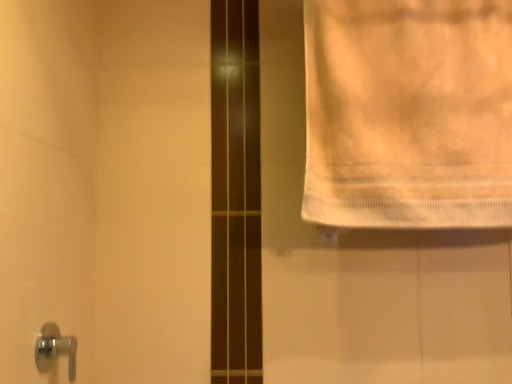
Question: Is white cotton towel at upper right a part of chrome metallic door handle at lower left?

Choices:
 (A) no
 (B) yes

Answer: (A)

Question: Is chrome metallic door handle at lower left not inside white cotton towel at upper right?

Choices:
 (A) yes
 (B) no

Answer: (A)

Question: From a real-world perspective, does chrome metallic door handle at lower left stand above white cotton towel at upper right?

Choices:
 (A) no
 (B) yes

Answer: (A)

Question: Is the position of chrome metallic door handle at lower left less distant than that of white cotton towel at upper right?

Choices:
 (A) yes
 (B) no

Answer: (A)

Question: Is chrome metallic door handle at lower left aimed at white cotton towel at upper right?

Choices:
 (A) yes
 (B) no

Answer: (B)

Question: From the image's perspective, is chrome metallic door handle at lower left over white cotton towel at upper right?

Choices:
 (A) no
 (B) yes

Answer: (A)

Question: Considering the relative sizes of white cotton towel at upper right and chrome metallic door handle at lower left in the image provided, is white cotton towel at upper right smaller than chrome metallic door handle at lower left?

Choices:
 (A) yes
 (B) no

Answer: (B)

Question: Does white cotton towel at upper right come in front of chrome metallic door handle at lower left?

Choices:
 (A) yes
 (B) no

Answer: (B)

Question: From the image's perspective, would you say white cotton towel at upper right is positioned over chrome metallic door handle at lower left?

Choices:
 (A) no
 (B) yes

Answer: (B)

Question: Can you confirm if white cotton towel at upper right is shorter than chrome metallic door handle at lower left?

Choices:
 (A) yes
 (B) no

Answer: (B)

Question: Is white cotton towel at upper right thinner than chrome metallic door handle at lower left?

Choices:
 (A) no
 (B) yes

Answer: (A)

Question: Does white cotton towel at upper right have a greater width compared to chrome metallic door handle at lower left?

Choices:
 (A) yes
 (B) no

Answer: (A)

Question: Relative to white cotton towel at upper right, is chrome metallic door handle at lower left in front or behind?

Choices:
 (A) front
 (B) behind

Answer: (A)